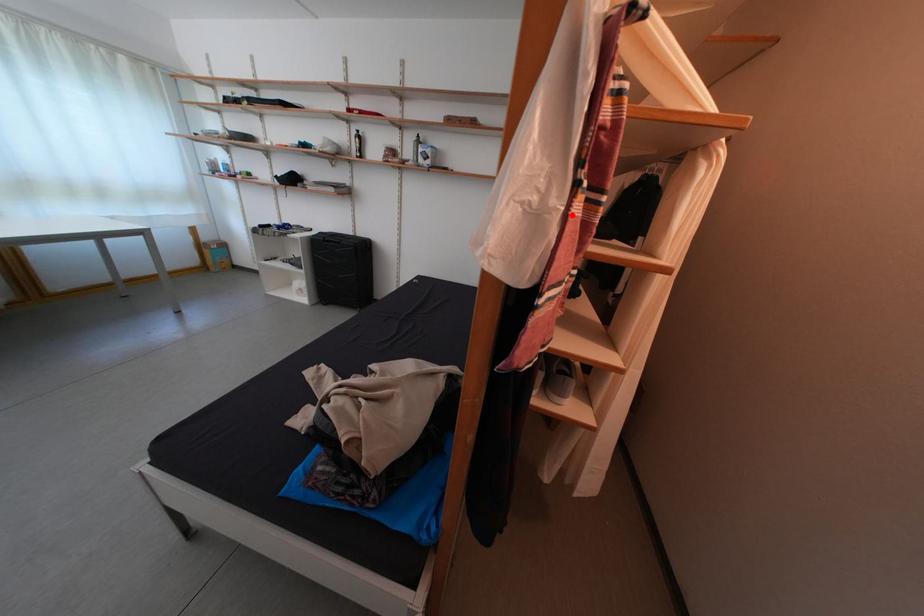
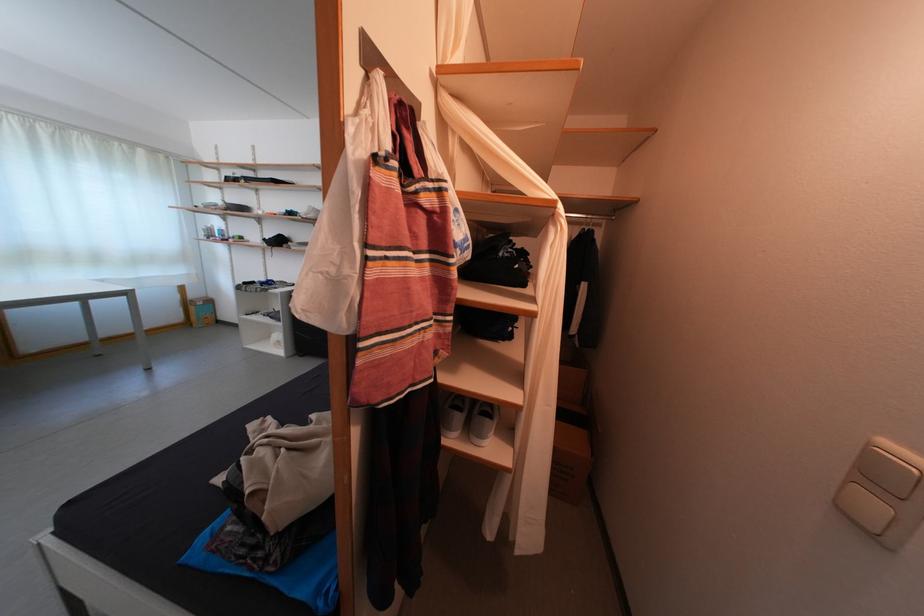
The point at the highlighted location is marked in the first image. Where is the corresponding point in the second image?

(366, 282)